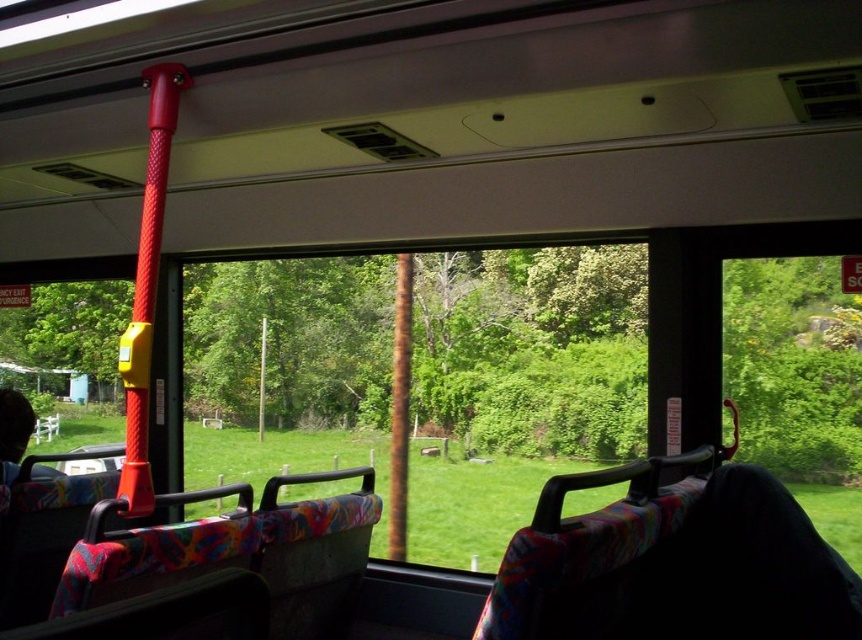
Question: Does green leafy tree at left have a lesser width compared to rusty metal pole at center?

Choices:
 (A) no
 (B) yes

Answer: (A)

Question: Does green leafy tree at left have a greater width compared to rusty metal pole at center?

Choices:
 (A) yes
 (B) no

Answer: (A)

Question: Which of the following is the farthest from the observer?

Choices:
 (A) green leafy tree at left
 (B) rusty metal pole at center

Answer: (A)

Question: Does green leafy tree at left appear under rusty metal pole at center?

Choices:
 (A) yes
 (B) no

Answer: (A)

Question: Which point appears farthest from the camera in this image?

Choices:
 (A) (110, 333)
 (B) (392, 355)

Answer: (A)